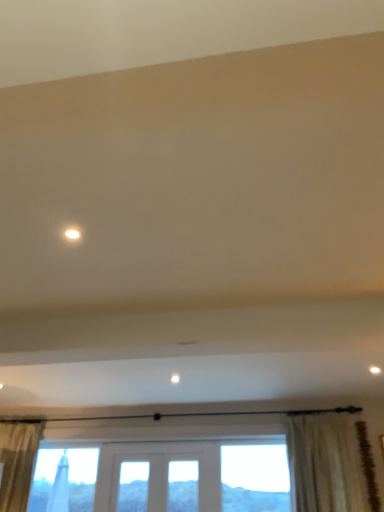
Question: Is point (364, 509) closer or farther from the camera than point (72, 236)?

Choices:
 (A) farther
 (B) closer

Answer: (A)

Question: From the image's perspective, is white textured curtain at lower right above or below matte white light at upper center?

Choices:
 (A) below
 (B) above

Answer: (A)

Question: Relative to matte white light at upper center, is white textured curtain at lower right in front or behind?

Choices:
 (A) behind
 (B) front

Answer: (A)

Question: From the image's perspective, relative to white textured curtain at lower right, is matte white light at upper center above or below?

Choices:
 (A) above
 (B) below

Answer: (A)

Question: Based on their sizes in the image, would you say matte white light at upper center is bigger or smaller than white textured curtain at lower right?

Choices:
 (A) big
 (B) small

Answer: (B)

Question: In terms of width, does matte white light at upper center look wider or thinner when compared to white textured curtain at lower right?

Choices:
 (A) thin
 (B) wide

Answer: (A)

Question: Is matte white light at upper center situated inside white textured curtain at lower right or outside?

Choices:
 (A) inside
 (B) outside

Answer: (B)